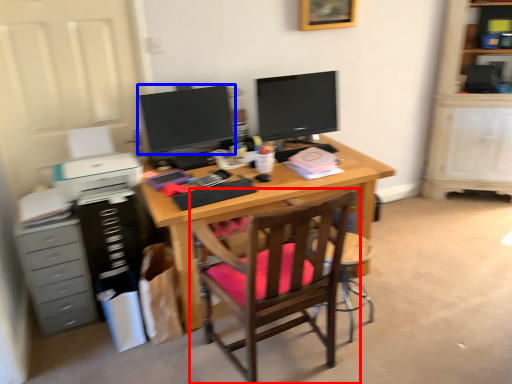
Question: Which object appears closest to the camera in this image, chair (highlighted by a red box) or television (highlighted by a blue box)?

Choices:
 (A) chair
 (B) television

Answer: (A)